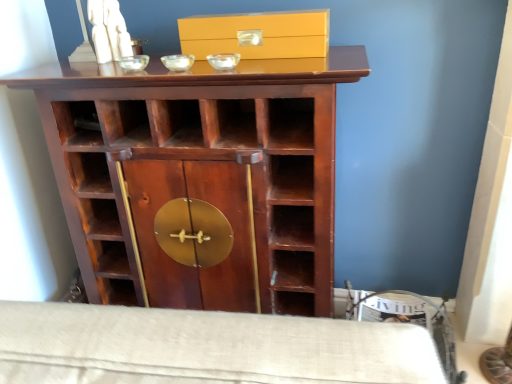
You are a GUI agent. You are given a task and a screenshot of the screen. Output one action in this format:
    pyautogui.click(x=<x>, y=<y>)
    Task: Click on the matte yellow box at center
    
    Given the screenshot: What is the action you would take?
    pyautogui.click(x=257, y=34)

In the scene shown: Measure the distance between point [269,26] and camera.

The distance of point [269,26] from camera is 1.01 meters.

What do you see at coordinates (257, 34) in the screenshot?
I see `matte yellow box at center` at bounding box center [257, 34].

The height and width of the screenshot is (384, 512). What do you see at coordinates (200, 177) in the screenshot?
I see `mahogany wood cupboard at center` at bounding box center [200, 177].

What is the approximate height of mahogany wood cupboard at center?

It is 37.78 inches.

Locate an element on the screen. This screenshot has width=512, height=384. mahogany wood cupboard at center is located at coordinates pyautogui.click(x=200, y=177).

Identify the location of matte yellow box at center. (257, 34).

Considering the positions of objects matte yellow box at center and mahogany wood cupboard at center in the image provided, who is more to the left, matte yellow box at center or mahogany wood cupboard at center?

From the viewer's perspective, mahogany wood cupboard at center appears more on the left side.

Which object is closer to the camera taking this photo, matte yellow box at center or mahogany wood cupboard at center?

mahogany wood cupboard at center is in front.

Between point (324, 25) and point (217, 257), which one is positioned behind?

Point (217, 257)

Based on the photo, from the image's perspective, which one is positioned higher, matte yellow box at center or mahogany wood cupboard at center?

From the image's view, matte yellow box at center is above.

From a real-world perspective, does matte yellow box at center sit lower than mahogany wood cupboard at center?

No.

In terms of width, does matte yellow box at center look wider or thinner when compared to mahogany wood cupboard at center?

Clearly, matte yellow box at center has less width compared to mahogany wood cupboard at center.

Is matte yellow box at center taller or shorter than mahogany wood cupboard at center?

matte yellow box at center is shorter than mahogany wood cupboard at center.

Considering the sizes of objects matte yellow box at center and mahogany wood cupboard at center in the image provided, who is smaller, matte yellow box at center or mahogany wood cupboard at center?

matte yellow box at center.

Is mahogany wood cupboard at center inside matte yellow box at center?

No, mahogany wood cupboard at center is not inside matte yellow box at center.

Is matte yellow box at center directly adjacent to mahogany wood cupboard at center?

matte yellow box at center and mahogany wood cupboard at center are clearly separated.

Is matte yellow box at center turned away from mahogany wood cupboard at center?

matte yellow box at center does not have its back to mahogany wood cupboard at center.

What's the angular difference between matte yellow box at center and mahogany wood cupboard at center's facing directions?

They differ by 0.000528 degrees in their facing directions.

The height and width of the screenshot is (384, 512). Find the location of `cupboard below the matte yellow box at center (from a real-world perspective)`. cupboard below the matte yellow box at center (from a real-world perspective) is located at coordinates (200, 177).

Considering the positions of objects mahogany wood cupboard at center and matte yellow box at center in the image provided, who is more to the right, mahogany wood cupboard at center or matte yellow box at center?

matte yellow box at center is more to the right.

Is mahogany wood cupboard at center closer to the viewer compared to matte yellow box at center?

Yes, it is in front of matte yellow box at center.

Considering the points (280, 60) and (231, 29), which point is behind, point (280, 60) or point (231, 29)?

Positioned behind is point (231, 29).

From the image's perspective, is mahogany wood cupboard at center located above matte yellow box at center?

No, from the image's perspective, mahogany wood cupboard at center is not above matte yellow box at center.

From a real-world perspective, who is located lower, mahogany wood cupboard at center or matte yellow box at center?

From a 3D spatial view, mahogany wood cupboard at center is below.

Does mahogany wood cupboard at center have a greater width compared to matte yellow box at center?

Correct, the width of mahogany wood cupboard at center exceeds that of matte yellow box at center.

Between mahogany wood cupboard at center and matte yellow box at center, which one has less height?

matte yellow box at center is shorter.

Considering the sizes of mahogany wood cupboard at center and matte yellow box at center in the image, is mahogany wood cupboard at center bigger or smaller than matte yellow box at center?

Considering their sizes, mahogany wood cupboard at center takes up more space than matte yellow box at center.

Is mahogany wood cupboard at center located outside matte yellow box at center?

Yes, mahogany wood cupboard at center is not within matte yellow box at center.

Is mahogany wood cupboard at center placed right next to matte yellow box at center?

No, mahogany wood cupboard at center is not next to matte yellow box at center.

Is mahogany wood cupboard at center facing away from matte yellow box at center?

mahogany wood cupboard at center is not turned away from matte yellow box at center.

At what (x,y) coordinates should I click in order to perform the action: click on box located above the mahogany wood cupboard at center (from a real-world perspective). Please return your answer as a coordinate pair (x, y). The height and width of the screenshot is (384, 512). Looking at the image, I should click on (257, 34).

Where is `box above the mahogany wood cupboard at center (from the image's perspective)`? The height and width of the screenshot is (384, 512). box above the mahogany wood cupboard at center (from the image's perspective) is located at coordinates (257, 34).

Locate an element on the screen. box on the right of mahogany wood cupboard at center is located at coordinates tap(257, 34).